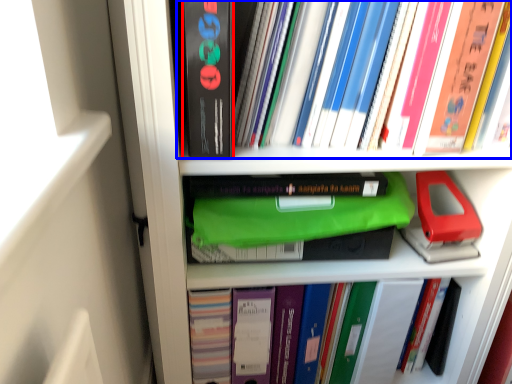
Question: Among these objects, which one is farthest to the camera, paperback book (highlighted by a red box) or book (highlighted by a blue box)?

Choices:
 (A) paperback book
 (B) book

Answer: (B)